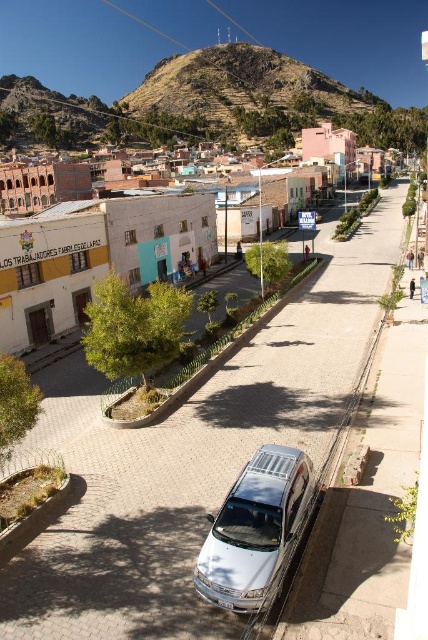
You are a delivery driver who needs to park your vehicle on the street. You see the rugged brown hill at upper center and the silver metallic van at center. Which object is taller, and does this affect your parking decision?

The rugged brown hill at upper center is taller than the silver metallic van at center. However, since hills are stationary and typically much larger than vehicles, this height difference does not impact parking decisions, which are more influenced by road space and van positioning.

You are a delivery driver who needs to back out of the parking space where the silver metallic van at center is parked. There is a white concrete building at center blocking your path. Can you safely back out without hitting the building?

The white concrete building at center is positioned over the silver metallic van at center, meaning the van is parked directly in front of the building. To back out safely, you would need to ensure there is enough space between the van and the building. However, since the building is positioned over the van, it suggests they are aligned along the same axis, making it difficult to maneuver around. It might be challenging to back out without hitting the building, so proceed with caution and check your mirrors